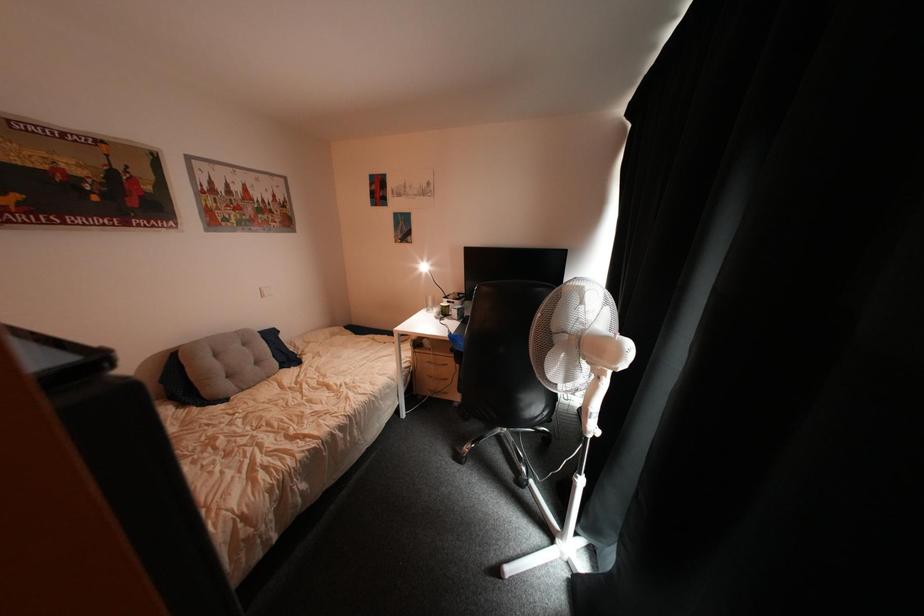
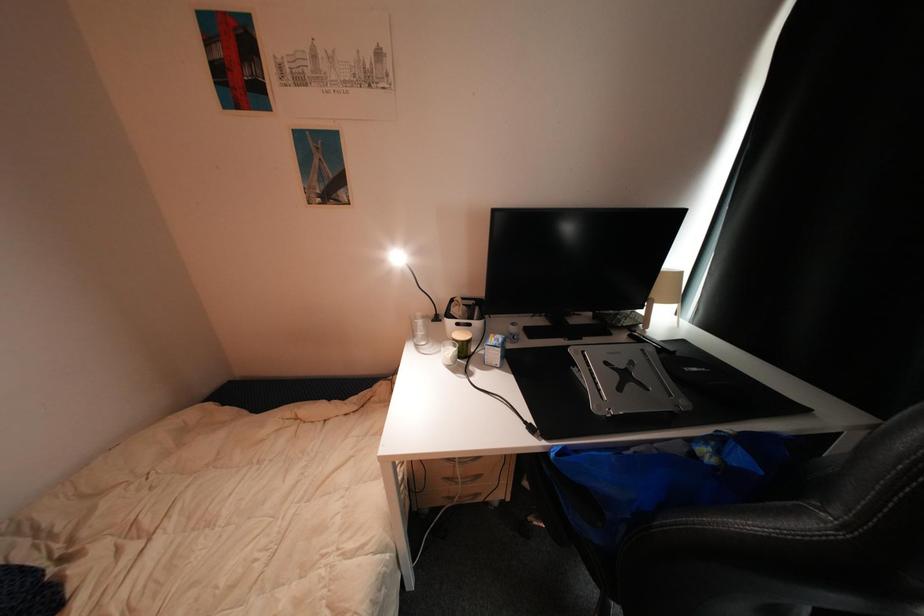
Looking at this image, which direction would the cameraman need to move to produce the second image?

The cameraman moved toward left, forward.